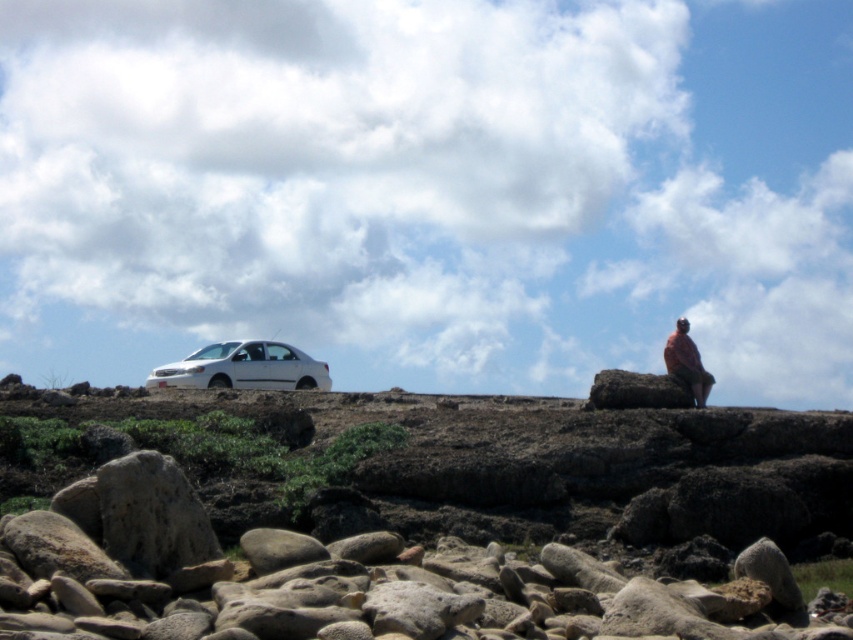
Question: Which point appears farthest from the camera in this image?

Choices:
 (A) (438, 620)
 (B) (206, 352)
 (C) (672, 355)

Answer: (B)

Question: Observing the image, what is the correct spatial positioning of white matte car at upper left in reference to pink fabric at upper right?

Choices:
 (A) left
 (B) right

Answer: (A)

Question: In this image, where is white matte sedan at left located relative to pink fabric at upper right?

Choices:
 (A) below
 (B) above

Answer: (A)

Question: Can you confirm if white matte car at upper left is positioned to the left of white matte sedan at left?

Choices:
 (A) yes
 (B) no

Answer: (B)

Question: Which point is farther from the camera taking this photo?

Choices:
 (A) [646, 422]
 (B) [669, 358]

Answer: (B)

Question: Based on their relative distances, which object is nearer to the pink fabric at upper right?

Choices:
 (A) white matte car at upper left
 (B) white matte sedan at left

Answer: (A)